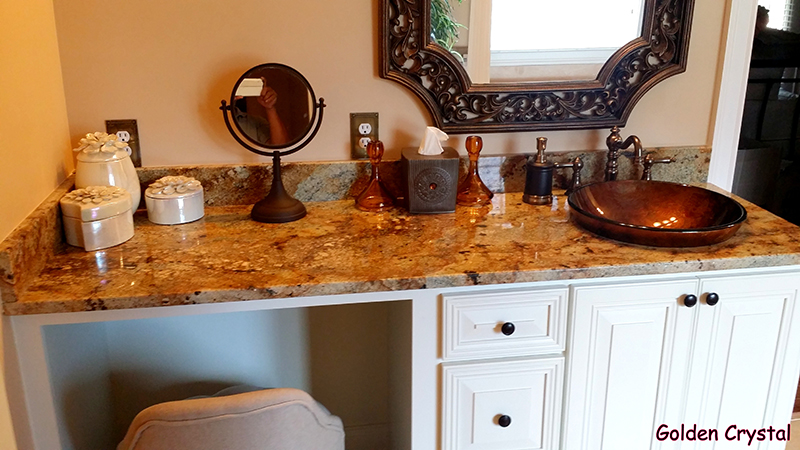
Identify the location of sink. This screenshot has width=800, height=450. (650, 222).